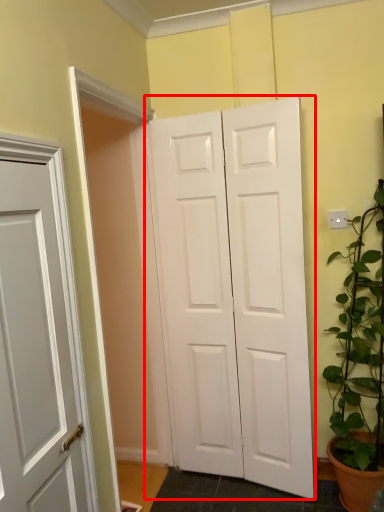
Question: From the image, what is the correct spatial relationship of door (annotated by the red box) in relation to houseplant?

Choices:
 (A) left
 (B) right

Answer: (A)